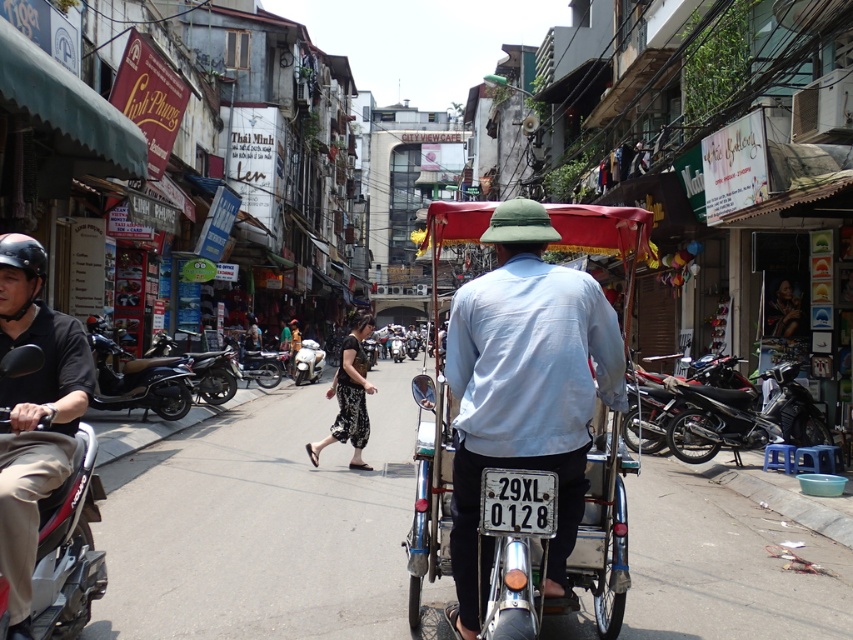
Question: Can you confirm if black matte motorcycle at right is smaller than shiny black scooter at left?

Choices:
 (A) yes
 (B) no

Answer: (A)

Question: Which object appears farthest from the camera in this image?

Choices:
 (A) black textured pants at center
 (B) shiny black motorcycle at right
 (C) shiny black motorcycle at left
 (D) metallic silver scooter at center

Answer: (D)

Question: Is light blue fabric shirt at center thinner than shiny black motorcycle at left?

Choices:
 (A) no
 (B) yes

Answer: (A)

Question: Which point is closer to the camera?

Choices:
 (A) white metallic license plate at center
 (B) shiny black motorcycle at right
 (C) silver metallic scooter at center

Answer: (A)

Question: Among these points, which one is farthest from the camera?

Choices:
 (A) (99, 348)
 (B) (78, 342)
 (C) (489, 525)

Answer: (A)

Question: Is black matte helmet at left further to camera compared to shiny black motorcycle at left?

Choices:
 (A) no
 (B) yes

Answer: (A)